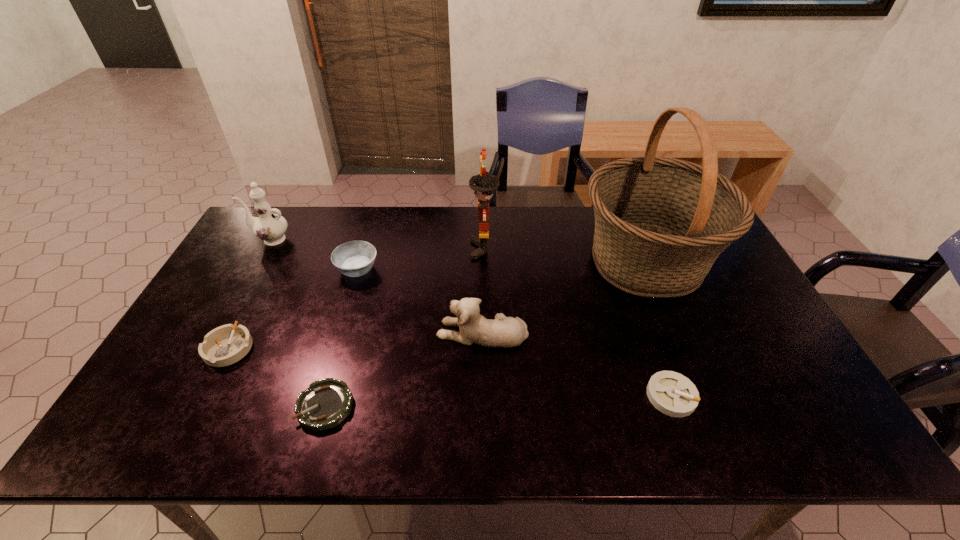
Where is `vacant position at the left edge of the desktop`? The image size is (960, 540). vacant position at the left edge of the desktop is located at coordinates (222, 305).

Where is `free space at the right edge of the desktop`? free space at the right edge of the desktop is located at coordinates (732, 338).

This screenshot has height=540, width=960. In the image, there is a desktop. In order to click on free space at the far left corner in this screenshot , I will do `click(284, 234)`.

Locate an element on the screen. The height and width of the screenshot is (540, 960). free point between the leftmost ashtray and the puppy is located at coordinates [356, 340].

Where is `empty location between the sixth shortest object and the third nearest ashtray`? This screenshot has height=540, width=960. empty location between the sixth shortest object and the third nearest ashtray is located at coordinates (250, 294).

I want to click on free space between the shortest ashtray and the chinaware, so click(x=298, y=323).

Locate an element on the screen. The height and width of the screenshot is (540, 960). vacant space that is in between the fifth shortest object and the rightmost ashtray is located at coordinates (577, 364).

Identify the location of free spot between the rightmost ashtray and the third nearest ashtray. (450, 372).

At what (x,y) coordinates should I click in order to perform the action: click on free area in between the shortest object and the fourth tallest object. Please return your answer as a coordinate pair (x, y). The height and width of the screenshot is (540, 960). Looking at the image, I should click on (404, 369).

At what (x,y) coordinates should I click in order to perform the action: click on free space between the farthest ashtray and the puppy. Please return your answer as a coordinate pair (x, y). The height and width of the screenshot is (540, 960). Looking at the image, I should click on (420, 301).